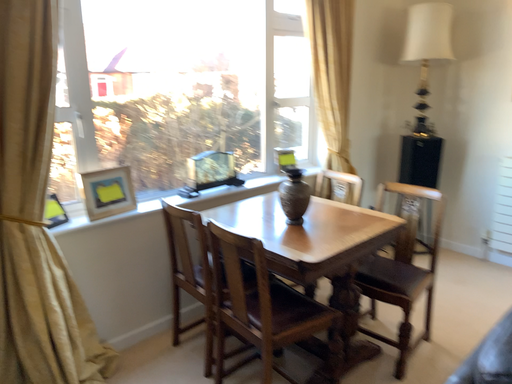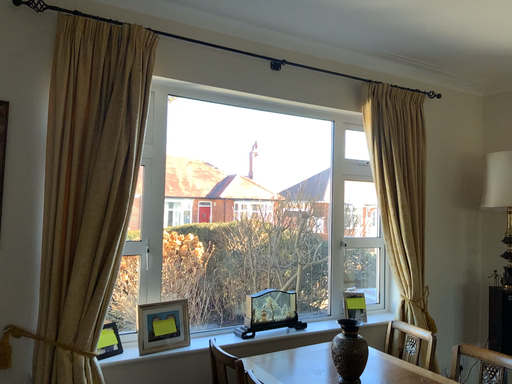
Question: Which way did the camera rotate in the video?

Choices:
 (A) rotated right
 (B) rotated left

Answer: (B)